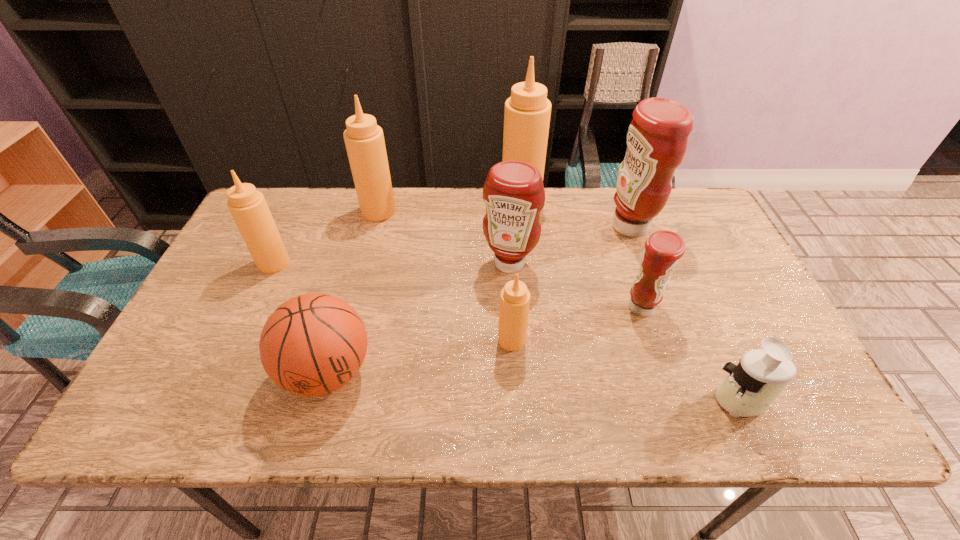
Where is `free space located 0.130m on the left of the second nearest condiment`? The width and height of the screenshot is (960, 540). free space located 0.130m on the left of the second nearest condiment is located at coordinates (572, 308).

Where is `vacant space located 0.140m on the right of the nearest tan condiment`? vacant space located 0.140m on the right of the nearest tan condiment is located at coordinates (584, 340).

Where is `vacant area located on the back of the basketball`? The image size is (960, 540). vacant area located on the back of the basketball is located at coordinates (345, 312).

Locate an element on the screen. vacant space situated on the back of the juicer is located at coordinates (699, 307).

The height and width of the screenshot is (540, 960). In order to click on basketball that is at the near edge in this screenshot , I will do `click(313, 344)`.

Image resolution: width=960 pixels, height=540 pixels. What are the coordinates of `juicer that is positioned at the near edge` in the screenshot? It's located at (750, 388).

This screenshot has width=960, height=540. Find the location of `object that is positioned at the left edge`. object that is positioned at the left edge is located at coordinates (248, 207).

Locate an element on the screen. This screenshot has height=540, width=960. object that is positioned at the right edge is located at coordinates (750, 388).

This screenshot has height=540, width=960. In order to click on object present at the near right corner in this screenshot , I will do `click(750, 388)`.

The image size is (960, 540). Identify the location of free space at the far edge of the desktop. (404, 221).